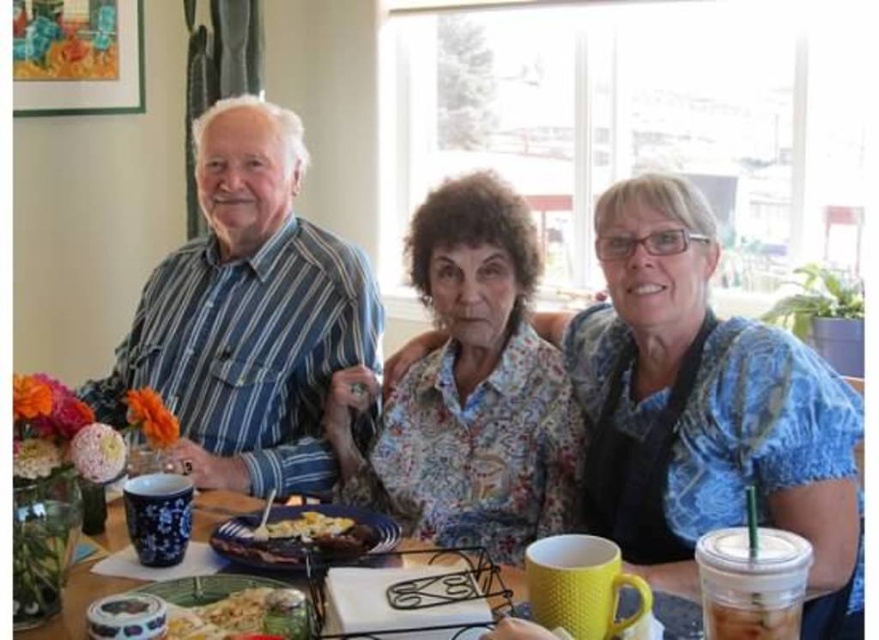
You are standing in the room and want to give a gift to the striped cotton shirt at left. The gift is placed at point (248, 316). Which direction should you walk to reach the gift?

The point (248, 316) marks the location of the striped cotton shirt at left, so you should walk towards the striped cotton shirt at left to reach the gift.

You are standing at the point labeled point (x=720, y=628) and want to walk to the point labeled point (x=147, y=362). Which direction should you move?

You should move forward because point (x=147, y=362) is behind point (x=720, y=628), so moving toward it would require facing away from your current position and walking backward. Wait, no, the description says point A is behind point B, so if you are at B, then A is behind you. To get to A from B, you need to move backward or turn around and move forward. Hmm, maybe the answer should clarify that since point A is behind point B, moving towards A would require moving in the direction away from the viewer. But I

You are a delivery person who needs to place a package between the striped cotton shirt at left and the yellow matte mug at center. The package is 18 inches long. Will it fit in the space between them?

The distance between the striped cotton shirt at left and the yellow matte mug at center is 20.46 inches. Since the package is 18 inches long, it will fit in the space between them as there is enough room.